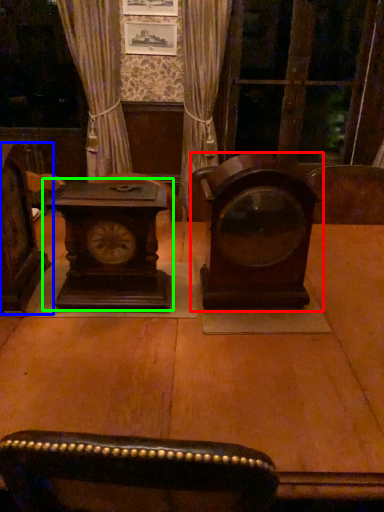
Question: Which is farther away from alarm clock (highlighted by a red box)? furniture (highlighted by a blue box) or alarm clock (highlighted by a green box)?

Choices:
 (A) furniture
 (B) alarm clock

Answer: (A)